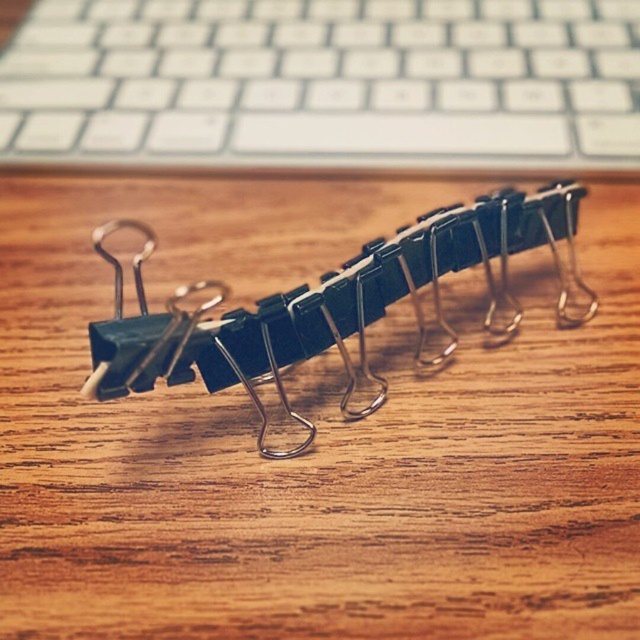
You are organizing your desk and need to place the white plastic keyboard at upper center and the metallic silver binder clip at center. If you want to arrange them so that the taller item is placed closer to you, which object should be closer?

The metallic silver binder clip at center should be placed closer because it is taller than the white plastic keyboard at upper center according to the description.

You are organizing items on a desk and need to place a new object near the white plastic keyboard at upper center. Based on the coordinates provided in the description, where should you position the new object to ensure it is close to the keyboard?

The white plastic keyboard at upper center is located at point (324,83), so you should position the new object near those coordinates to ensure it is close to the keyboard.

You are organizing your desk and want to place the white plastic keyboard at upper center and the metallic silver binder clip at center. Which object takes up more space on the desk?

The metallic silver binder clip at center takes up more space on the desk than the white plastic keyboard at upper center because it is larger.